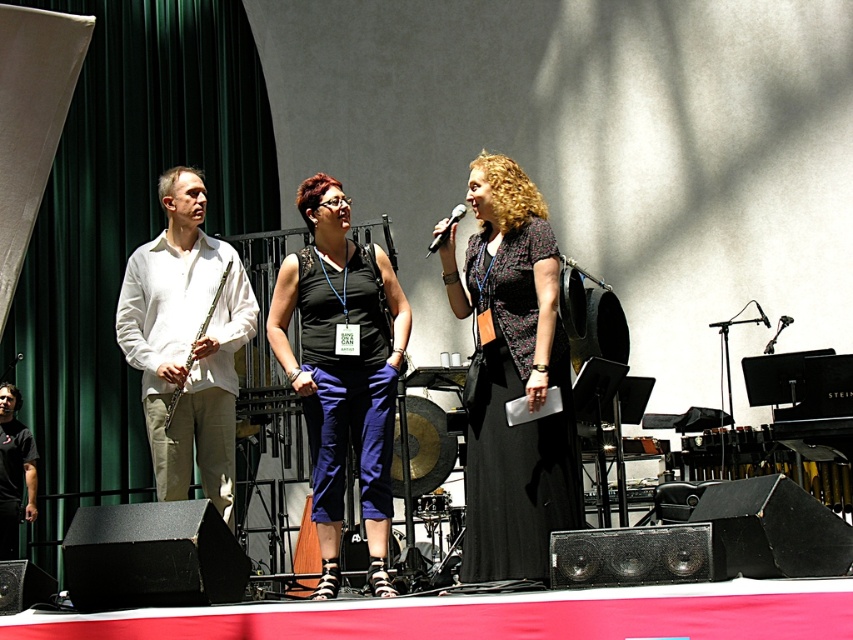
Question: Can you confirm if matte silver flute at left is positioned above black matte microphone at center?

Choices:
 (A) no
 (B) yes

Answer: (A)

Question: Which point is closer to the camera?

Choices:
 (A) black textured dress at center
 (B) matte silver flute at left
 (C) white matte shirt at left
 (D) black fabric dress at center

Answer: (A)

Question: Can you confirm if black fabric shirt at left is positioned below black matte microphone at center?

Choices:
 (A) yes
 (B) no

Answer: (A)

Question: Which of the following is the farthest from the observer?

Choices:
 (A) black fabric dress at center
 (B) matte silver flute at left
 (C) white matte shirt at left
 (D) black textured dress at center

Answer: (B)

Question: Is white matte shirt at left in front of black matte microphone at center?

Choices:
 (A) no
 (B) yes

Answer: (A)

Question: Estimate the real-world distances between objects in this image. Which object is closer to the white matte shirt at left?

Choices:
 (A) black textured dress at center
 (B) black fabric dress at center

Answer: (B)